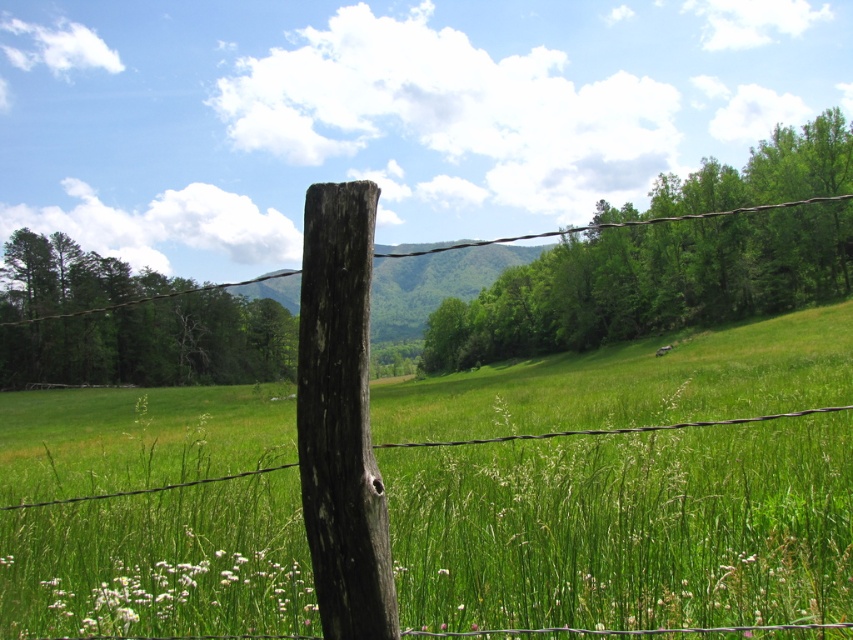
Question: Is weathered wood post at center above brown wooden wire at center?

Choices:
 (A) yes
 (B) no

Answer: (B)

Question: Observing the image, what is the correct spatial positioning of weathered wood post at center in reference to brown wooden wire at center?

Choices:
 (A) below
 (B) above

Answer: (A)

Question: Which point appears closest to the camera in this image?

Choices:
 (A) (358, 252)
 (B) (782, 204)

Answer: (A)

Question: Is weathered wood post at center wider than brown wooden wire at center?

Choices:
 (A) no
 (B) yes

Answer: (A)

Question: Which point is farther to the camera?

Choices:
 (A) (514, 237)
 (B) (318, 392)

Answer: (A)